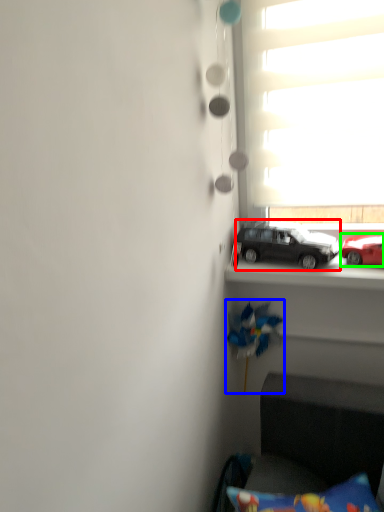
Question: Based on their relative distances, which object is nearer to car (highlighted by a red box)? Choose from toy (highlighted by a blue box) and car (highlighted by a green box).

Choices:
 (A) toy
 (B) car

Answer: (B)